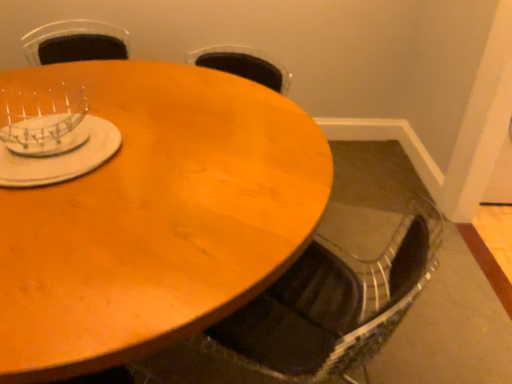
Find the location of a particular element. This screenshot has width=512, height=384. vacant area located to the right-hand side of white matte plate at upper left, which is the 2th tableware from top to bottom is located at coordinates (178, 150).